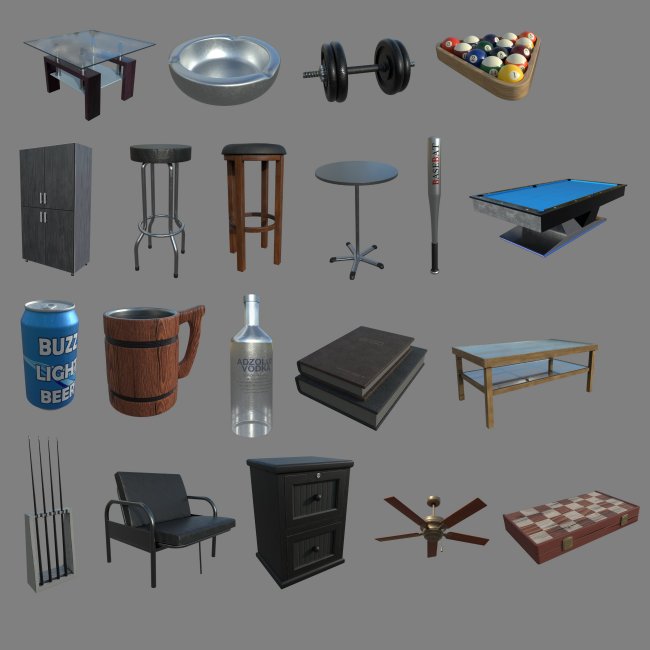
What are the coordinates of `corners` in the screenshot? It's located at (82, 62), (151, 41), (94, 27), (27, 42).